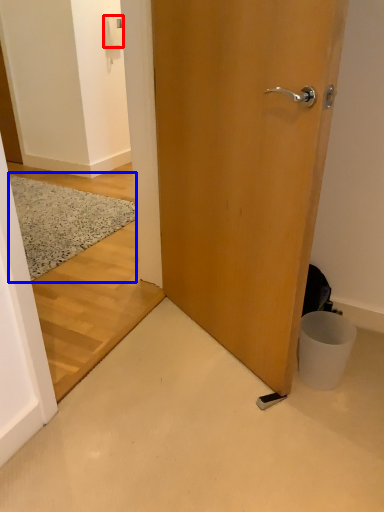
Question: Among these objects, which one is farthest to the camera, light switch (highlighted by a red box) or doormat (highlighted by a blue box)?

Choices:
 (A) light switch
 (B) doormat

Answer: (A)